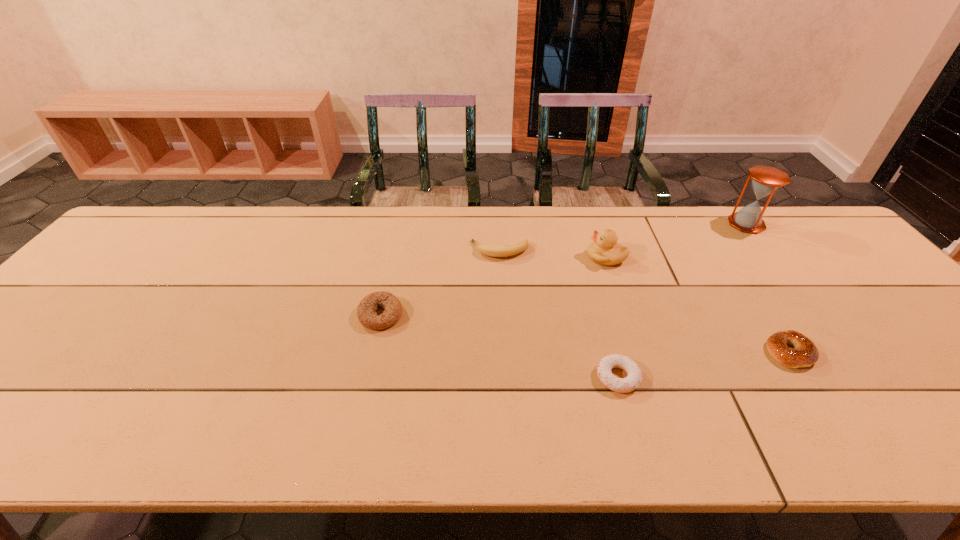
Where is `hourglass`? The image size is (960, 540). hourglass is located at coordinates (766, 180).

In order to click on the tallest object in this screenshot , I will do tap(766, 180).

You are a GUI agent. You are given a task and a screenshot of the screen. Output one action in this format:
    pyautogui.click(x=<x>, y=<y>)
    Task: Click on the fifth shortest object
    
    Given the screenshot: What is the action you would take?
    pyautogui.click(x=604, y=250)

Find the location of a particular element. Image resolution: width=960 pixels, height=540 pixels. banana is located at coordinates (518, 247).

The width and height of the screenshot is (960, 540). Find the location of `the fourth farthest object`. the fourth farthest object is located at coordinates (366, 309).

This screenshot has height=540, width=960. In order to click on the left bagel in this screenshot , I will do `click(366, 309)`.

This screenshot has width=960, height=540. I want to click on the nearer bagel, so click(804, 353).

What are the coordinates of `the fifth object from left to right` in the screenshot? It's located at (804, 353).

I want to click on doughnut, so click(x=622, y=385).

This screenshot has width=960, height=540. What are the coordinates of `vacant space located on the left of the farthest object` in the screenshot? It's located at (625, 224).